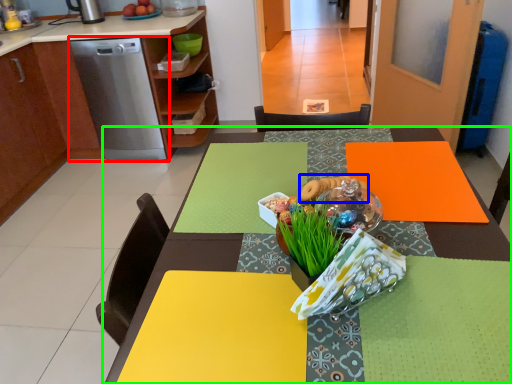
Question: Based on their relative distances, which object is farther from home appliance (highlighted by a red box)? Choose from food (highlighted by a blue box) and table (highlighted by a green box).

Choices:
 (A) food
 (B) table

Answer: (B)